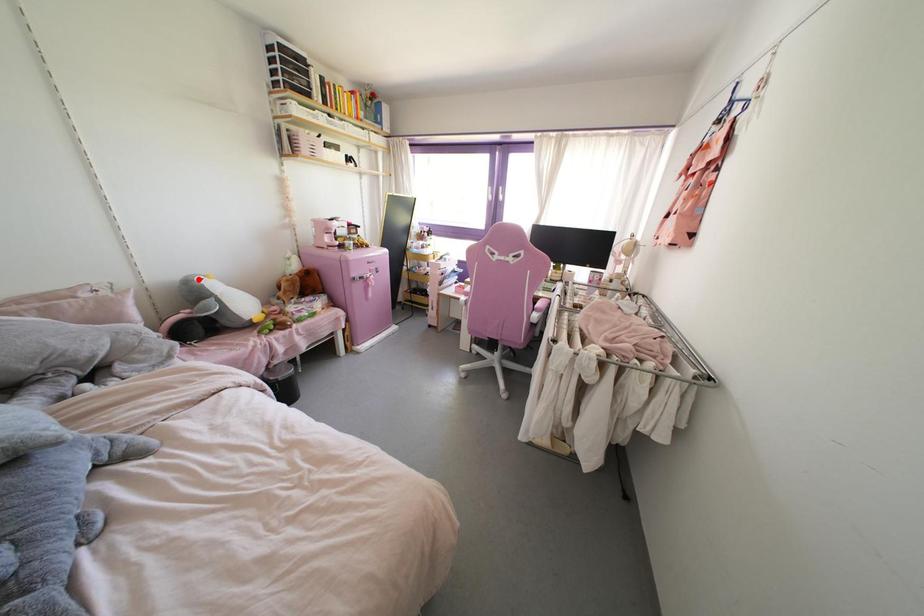
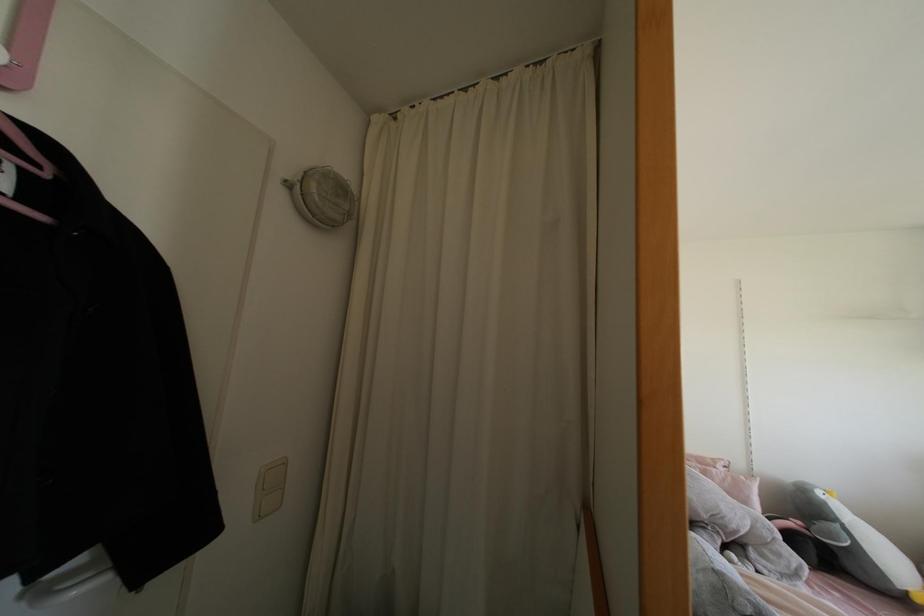
Locate, in the second image, the point that corresponds to the highlighted location in the first image.

(819, 493)